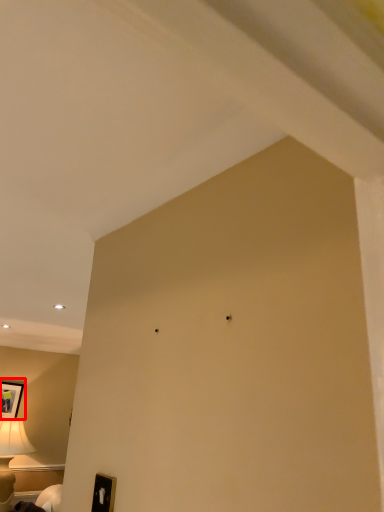
Question: From the image's perspective, where is picture frame (annotated by the red box) located relative to furniture?

Choices:
 (A) above
 (B) below

Answer: (A)